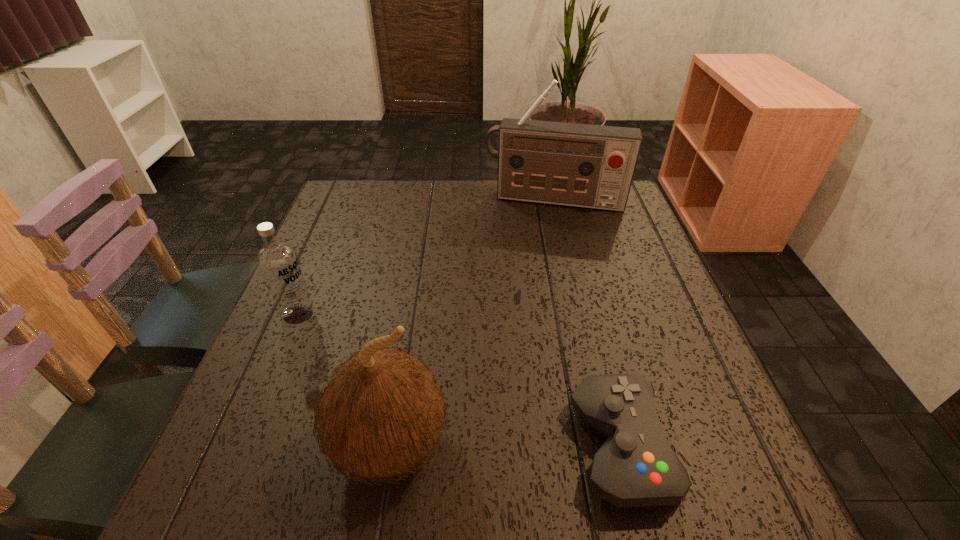
The image size is (960, 540). I want to click on the second object from left to right, so click(382, 413).

This screenshot has width=960, height=540. Find the location of `the third shortest object`. the third shortest object is located at coordinates (382, 413).

Locate an element on the screen. This screenshot has width=960, height=540. control is located at coordinates (635, 467).

Where is `the second farthest object`? the second farthest object is located at coordinates 278,262.

You are a GUI agent. You are given a task and a screenshot of the screen. Output one action in this format:
    pyautogui.click(x=<x>, y=<y>)
    Task: Click on the second shortest object
    Image resolution: width=960 pixels, height=540 pixels.
    Given the screenshot: What is the action you would take?
    pyautogui.click(x=278, y=262)

The image size is (960, 540). I want to click on the farthest object, so click(591, 166).

Where is `vacant space situated on the left of the control`? vacant space situated on the left of the control is located at coordinates (379, 447).

You are a GUI agent. You are given a task and a screenshot of the screen. Output one action in this format:
    pyautogui.click(x=<x>, y=<y>)
    Task: Click on the vacant space located 0.130m on the front label of the third nearest object
    The image size is (960, 540).
    Given the screenshot: What is the action you would take?
    pyautogui.click(x=351, y=347)

You are a GUI agent. You are given a task and a screenshot of the screen. Output one action in this format:
    pyautogui.click(x=<x>, y=<y>)
    Task: Click on the free region located 0.280m on the front label of the third nearest object
    The height and width of the screenshot is (540, 960).
    Given the screenshot: What is the action you would take?
    pyautogui.click(x=407, y=381)

Where is `free region located 0.360m on the front label of the third nearest object`? free region located 0.360m on the front label of the third nearest object is located at coordinates (440, 402).